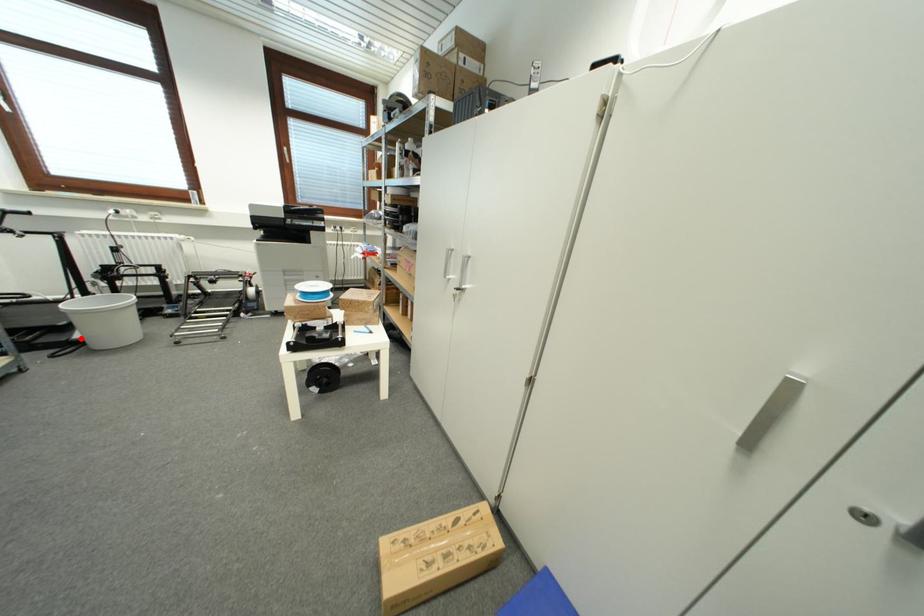
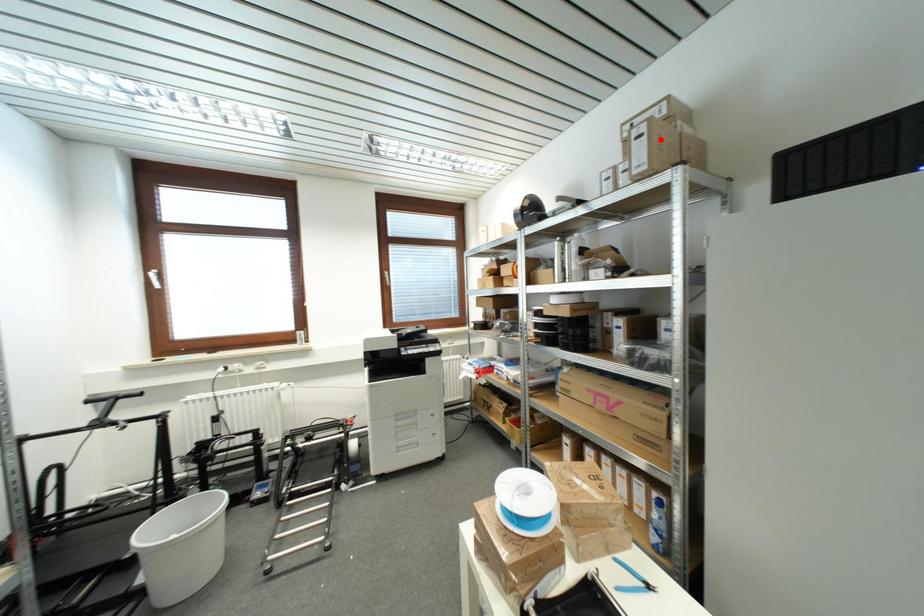
I am providing you with two images of the same scene from different viewpoints. A red point is marked on the first image and another point is marked on the second image. Is the marked point in image1 the same physical position as the marked point in image2?

No